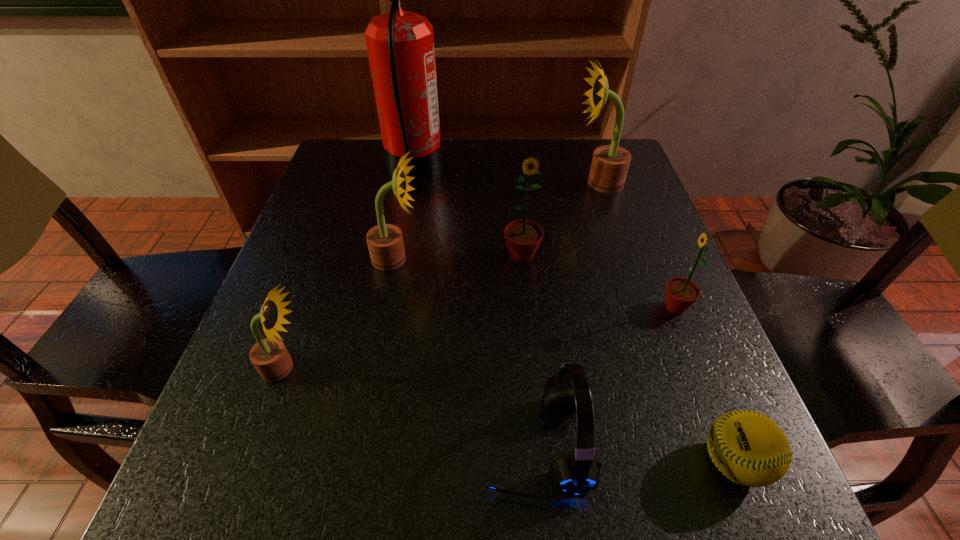
You are a GUI agent. You are given a task and a screenshot of the screen. Output one action in this format:
    pyautogui.click(x=<x>, y=<y>)
    Task: Click on the vacant area situated 0.160m on the logo side of the softball
    The width and height of the screenshot is (960, 540).
    Given the screenshot: What is the action you would take?
    pyautogui.click(x=587, y=462)

Locate an element on the screen. fire extinguisher that is positioned at the far edge is located at coordinates (400, 44).

You are a GUI agent. You are given a task and a screenshot of the screen. Output one action in this format:
    pyautogui.click(x=<x>, y=<y>)
    Task: Click on the sunflower located in the far edge section of the desktop
    
    Given the screenshot: What is the action you would take?
    [610, 163]

Image resolution: width=960 pixels, height=540 pixels. I want to click on headset located in the near edge section of the desktop, so click(576, 470).

Identify the location of softball that is at the near edge. This screenshot has width=960, height=540. (749, 448).

Where is `fire extinguisher that is at the left edge`? Image resolution: width=960 pixels, height=540 pixels. fire extinguisher that is at the left edge is located at coordinates (400, 44).

Identify the location of sunflower that is at the left edge. (269, 356).

I want to click on softball located at the right edge, so click(x=749, y=448).

Find the location of `object that is at the far left corner`. object that is at the far left corner is located at coordinates (400, 44).

This screenshot has width=960, height=540. I want to click on object that is at the far right corner, so click(x=610, y=163).